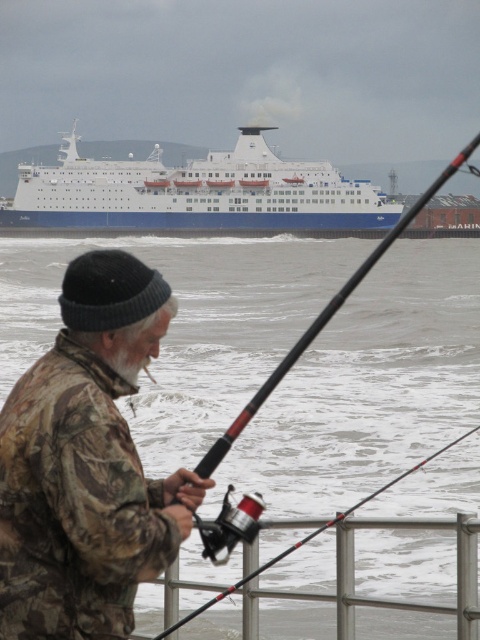
Question: Which object is closer to the camera taking this photo?

Choices:
 (A) camouflage fabric fishing pole at center
 (B) camouflage fabric jacket at left

Answer: (B)

Question: Which object is farther from the camera taking this photo?

Choices:
 (A) camouflage fabric jacket at left
 (B) white frothy water at lower center
 (C) camouflage fabric fishing pole at center
 (D) white matte ship at upper center

Answer: (D)

Question: Does white frothy water at lower center have a lesser width compared to camouflage fabric jacket at left?

Choices:
 (A) no
 (B) yes

Answer: (A)

Question: From the image, what is the correct spatial relationship of white frothy water at lower center in relation to camouflage fabric jacket at left?

Choices:
 (A) above
 (B) below

Answer: (A)

Question: Which point appears closest to the camera in this image?

Choices:
 (A) (421, 465)
 (B) (290, 168)
 (C) (338, 253)

Answer: (A)

Question: Is white matte ship at upper center behind camouflage fabric fishing pole at center?

Choices:
 (A) yes
 (B) no

Answer: (A)